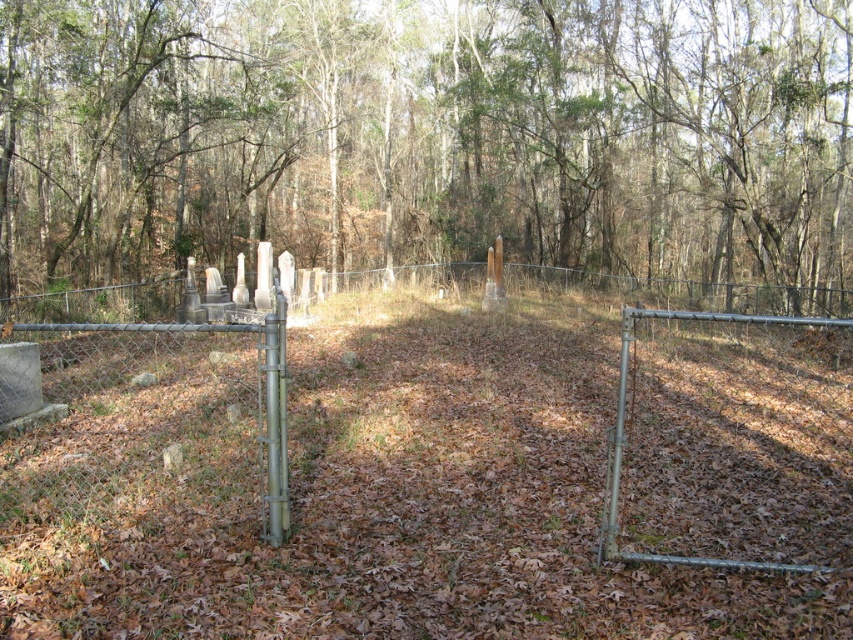
Question: Which object is farther from the camera taking this photo?

Choices:
 (A) green leafy tree at center
 (B) metal chain-link fence at center
 (C) rusty chain-link fence at center

Answer: (A)

Question: Observing the image, what is the correct spatial positioning of green leafy tree at center in reference to metal chain-link fence at center?

Choices:
 (A) left
 (B) right

Answer: (A)

Question: Which object is positioned farthest from the metal chain-link fence at center?

Choices:
 (A) rusty chain-link fence at center
 (B) green leafy tree at center

Answer: (B)

Question: Is metal chain-link fence at center closer to camera compared to rusty chain-link fence at center?

Choices:
 (A) yes
 (B) no

Answer: (A)

Question: Which object appears farthest from the camera in this image?

Choices:
 (A) green leafy tree at center
 (B) rusty chain-link fence at center
 (C) metal chain-link fence at center

Answer: (A)

Question: From the image, what is the correct spatial relationship of green leafy tree at center in relation to rusty chain-link fence at center?

Choices:
 (A) left
 (B) right

Answer: (B)